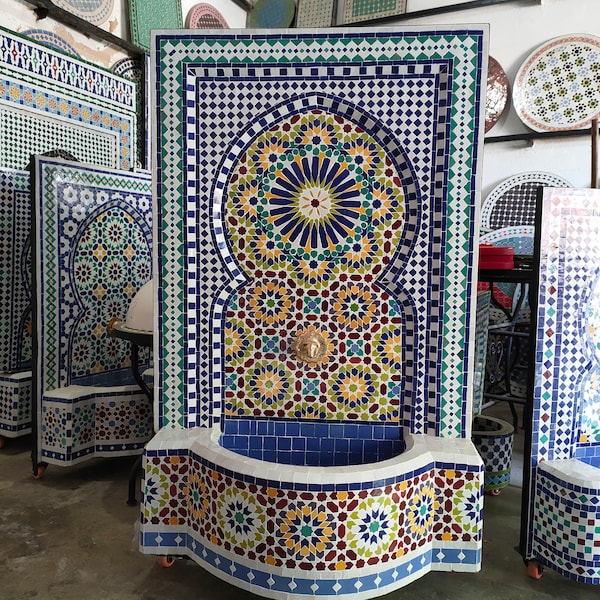
Where is `geometric floral tile design at the bottom`? The width and height of the screenshot is (600, 600). geometric floral tile design at the bottom is located at coordinates (354, 386), (396, 349), (356, 305), (265, 301), (233, 344), (269, 376), (344, 389).